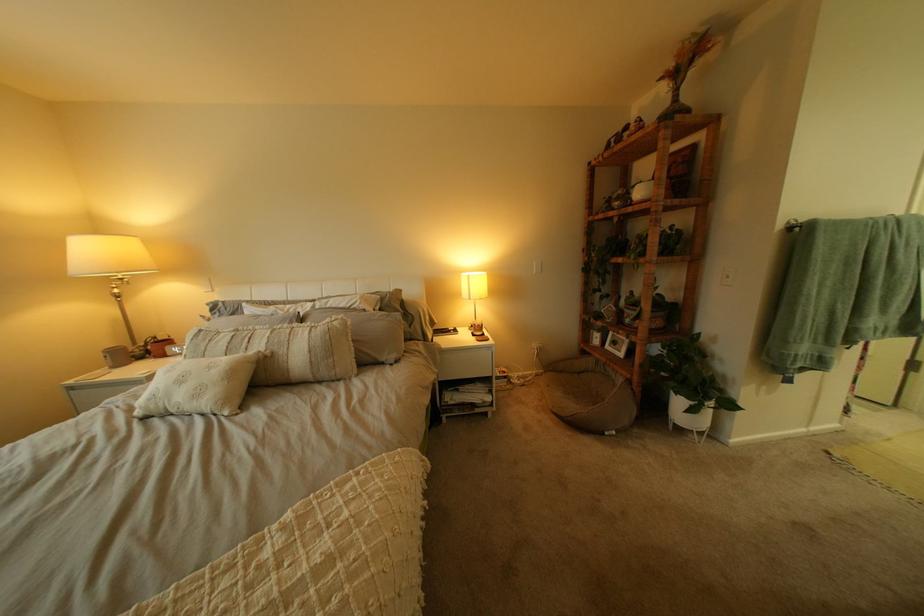
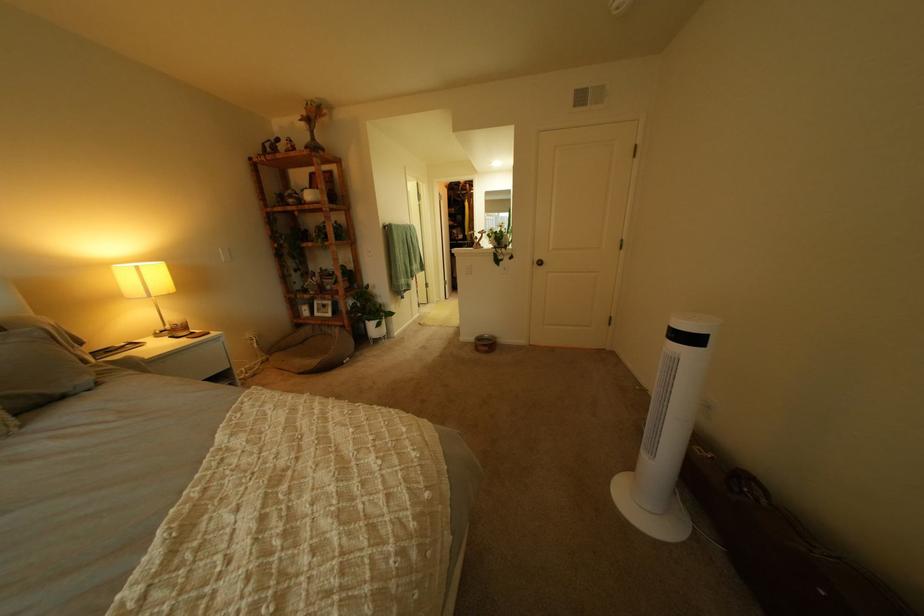
Question: The camera is either moving clockwise (left) or counter-clockwise (right) around the object. The first image is from the beginning of the video and the second image is from the end. Is the camera moving left or right when shooting the video?

Choices:
 (A) Left
 (B) Right

Answer: (A)